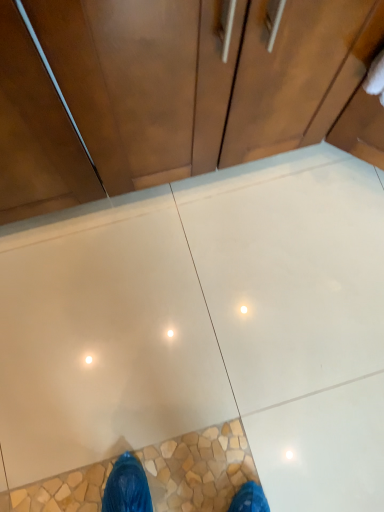
Identify the location of matte wood dresser at center. (174, 91).

Measure the distance between matte wood dresser at center and camera.

50.26 centimeters.

This screenshot has width=384, height=512. What do you see at coordinates (174, 91) in the screenshot? I see `matte wood dresser at center` at bounding box center [174, 91].

This screenshot has width=384, height=512. I want to click on matte wood dresser at center, so click(174, 91).